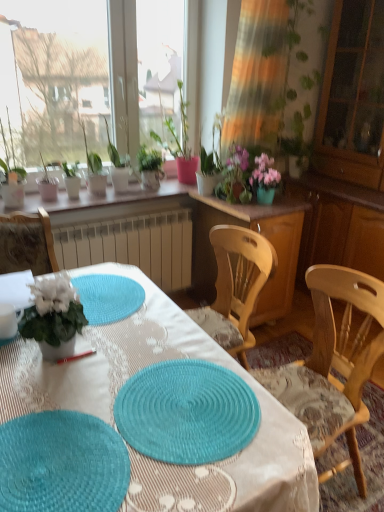
Question: From a real-world perspective, is green leafy plant at upper left, which ranks as the third houseplant in right-to-left order, physically located above or below teal woven placemat at center, the 2th mat positioned from the left?

Choices:
 (A) below
 (B) above

Answer: (B)

Question: Does point (120, 161) appear closer or farther from the camera than point (188, 433)?

Choices:
 (A) farther
 (B) closer

Answer: (A)

Question: Which object is positioned farthest from the teal woven mat at lower left, positioned as the 2th mat in right-to-left order?

Choices:
 (A) white matte plant at left, the 5th houseplant from the left
 (B) wooden cabinet at center
 (C) green leafy plant at upper left, which ranks as the third houseplant in right-to-left order
 (D) white ceramic pots at upper center
 (E) teal woven placemat at center, arranged as the 1th mat when viewed from the right

Answer: (C)

Question: Which is nearer to the matte white pot at center, which is the 1th houseplant from right to left?

Choices:
 (A) pink matte flower pot at upper center
 (B) wooden cabinet at center
 (C) transparent glass cabinet at right
 (D) matte white pot at upper left, positioned as the 2th houseplant in left-to-right order
 (E) white ceramic pots at upper center

Answer: (A)